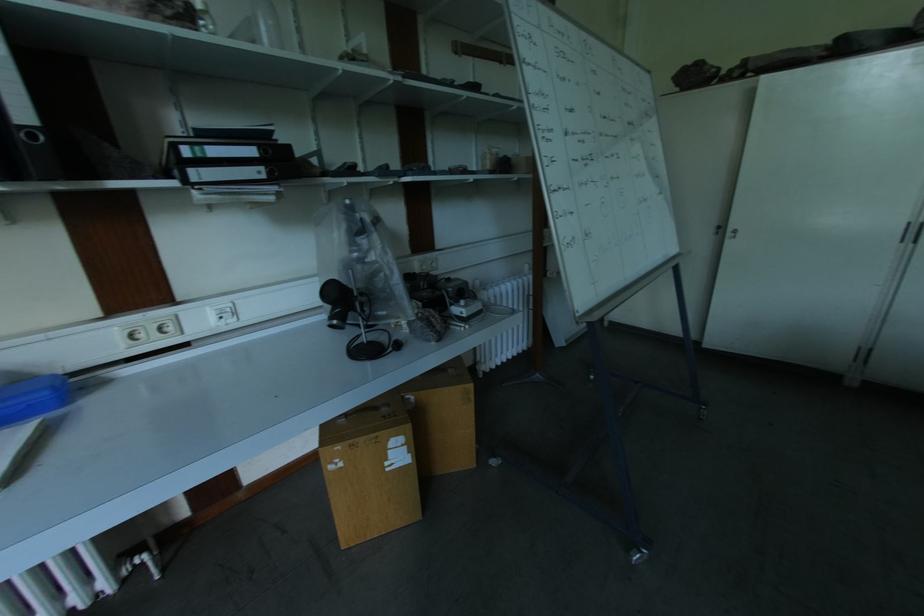
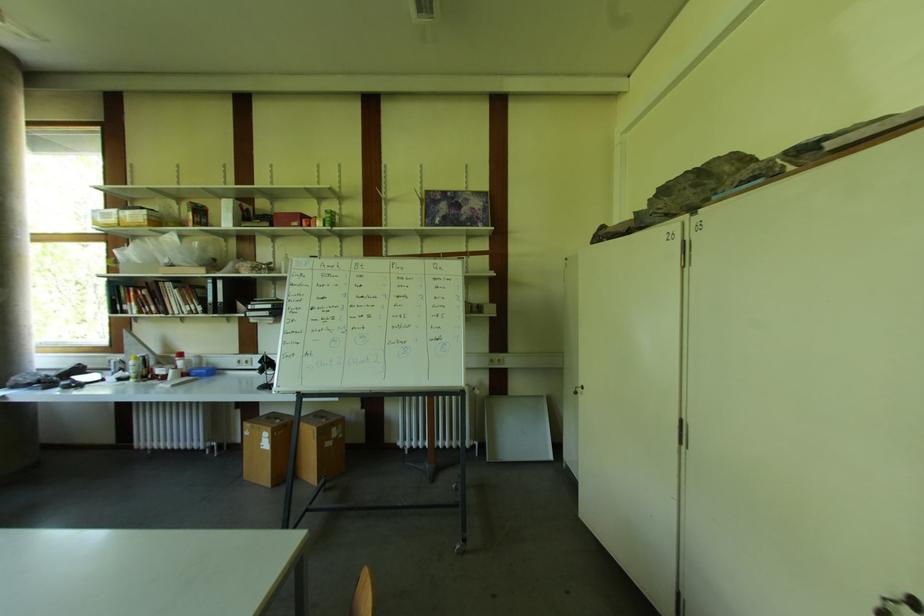
Where in the second image is the point corresponding to (354,448) from the first image?

(254, 428)